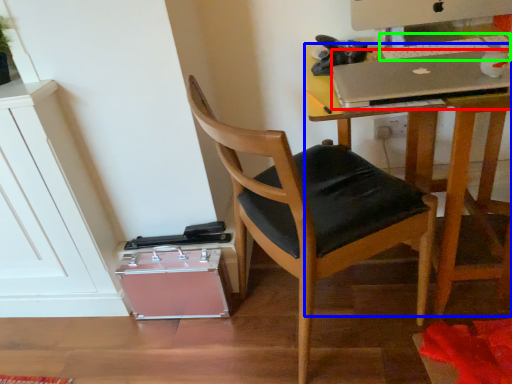
Question: Which object is positioned closest to laptop (highlighted by a red box)? Select from desk (highlighted by a blue box) and laptop keyboard (highlighted by a green box).

Choices:
 (A) desk
 (B) laptop keyboard

Answer: (B)